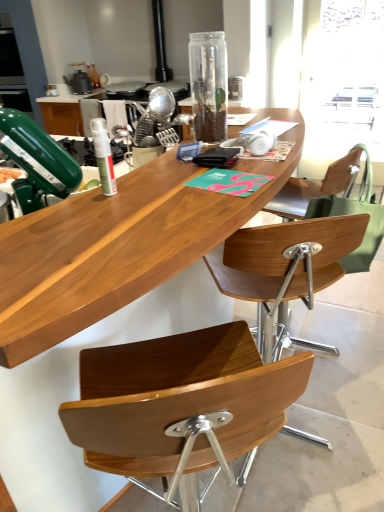
Question: Looking at their shapes, would you say green fabric handbag at right is wider or thinner than transparent glass bottle at center, the second bottle viewed from the left?

Choices:
 (A) wide
 (B) thin

Answer: (A)

Question: From the image's perspective, relative to transparent glass bottle at center, acting as the first bottle starting from the top, is green fabric handbag at right above or below?

Choices:
 (A) above
 (B) below

Answer: (B)

Question: Which object is positioned closest to the white matte spray can at center, the 2th bottle from the right?

Choices:
 (A) wooden chair at center
 (B) matte black kettle at upper left, the second appliance from the front
 (C) transparent glass bottle at center, acting as the first bottle starting from the top
 (D) wooden desk at center
 (E) white paper towel at upper center

Answer: (D)

Question: Estimate the real-world distances between objects in this image. Which object is closer to the white matte spray can at center, arranged as the first bottle when ordered from the bottom?

Choices:
 (A) transparent plastic window screen at upper right
 (B) metallic silver whisk at center, which is counted as the first appliance, starting from the right
 (C) matte black kettle at upper left, the second appliance positioned from the bottom
 (D) transparent glass bottle at center, which is the second bottle in front-to-back order
 (E) wooden chair at center

Answer: (E)